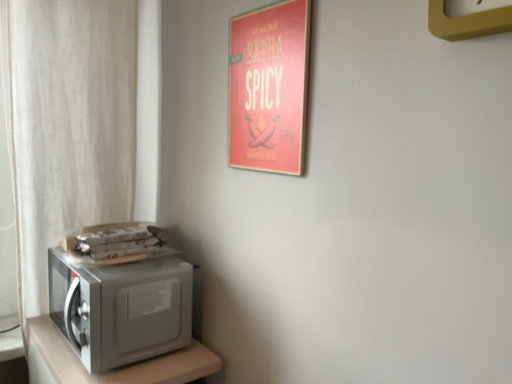
What do you see at coordinates (68, 124) in the screenshot? I see `white sheer curtain at left` at bounding box center [68, 124].

Locate an element on the screen. The image size is (512, 384). white sheer curtain at left is located at coordinates (68, 124).

Where is `satin silver microwave at lower left`? This screenshot has height=384, width=512. satin silver microwave at lower left is located at coordinates (122, 308).

Which of these two, satin silver microwave at left or yellow plastic clock at upper right, is thinner?

Thinner between the two is yellow plastic clock at upper right.

Is point (38, 319) less distant than point (475, 16)?

No, (38, 319) is behind (475, 16).

Is yellow plastic clock at upper right inside satin silver microwave at left?

Definitely not — yellow plastic clock at upper right is not inside satin silver microwave at left.

Does satin silver microwave at left lie in front of yellow plastic clock at upper right?

No, satin silver microwave at left is further to the viewer.

Relative to white sheer curtain at left, is satin silver microwave at left in front or behind?

Clearly, satin silver microwave at left is in front of white sheer curtain at left.

Can we say satin silver microwave at left lies outside white sheer curtain at left?

Absolutely, satin silver microwave at left is external to white sheer curtain at left.

Can you tell me how much satin silver microwave at left and white sheer curtain at left differ in facing direction?

There is a 90.3-degree angle between the facing directions of satin silver microwave at left and white sheer curtain at left.

Which object is positioned more to the right, satin silver microwave at left or white sheer curtain at left?

satin silver microwave at left.

Locate an element on the screen. clock above the white sheer curtain at left (from the image's perspective) is located at coordinates (467, 22).

From the image's perspective, is white sheer curtain at left positioned above or below yellow plastic clock at upper right?

From the image's perspective, white sheer curtain at left appears below yellow plastic clock at upper right.

Does point (30, 69) come farther from viewer compared to point (434, 25)?

Yes.

Would you say white sheer curtain at left is a long distance from yellow plastic clock at upper right?

white sheer curtain at left is positioned a significant distance from yellow plastic clock at upper right.

Between white sheer curtain at left and satin silver microwave at left, which one has smaller width?

With smaller width is white sheer curtain at left.

From the image's perspective, which one is positioned higher, white sheer curtain at left or satin silver microwave at left?

white sheer curtain at left.

Does white sheer curtain at left have a greater height compared to satin silver microwave at left?

Indeed, white sheer curtain at left has a greater height compared to satin silver microwave at left.

In the scene shown: Choose the correct answer: Is white sheer curtain at left inside satin silver microwave at left or outside it?

white sheer curtain at left cannot be found inside satin silver microwave at left.

In the image, there is a yellow plastic clock at upper right. Where is `home appliance below it (from the image's perspective)`? home appliance below it (from the image's perspective) is located at coordinates (122, 308).

From a real-world perspective, is satin silver microwave at lower left on top of yellow plastic clock at upper right?

No, from a real-world perspective, satin silver microwave at lower left is not above yellow plastic clock at upper right.

Is satin silver microwave at lower left at the right side of yellow plastic clock at upper right?

No.

Would you consider satin silver microwave at left to be distant from satin silver microwave at lower left?

Actually, satin silver microwave at left and satin silver microwave at lower left are a little close together.

Between satin silver microwave at left and satin silver microwave at lower left, which one appears on the right side from the viewer's perspective?

satin silver microwave at lower left is more to the right.

Is satin silver microwave at left positioned behind satin silver microwave at lower left?

No, satin silver microwave at left is closer to the viewer.

Looking at their sizes, would you say yellow plastic clock at upper right is wider or thinner than satin silver microwave at left?

yellow plastic clock at upper right is thinner than satin silver microwave at left.

Based on the photo, is yellow plastic clock at upper right next to satin silver microwave at left?

No, yellow plastic clock at upper right is not next to satin silver microwave at left.

Between yellow plastic clock at upper right and satin silver microwave at left, which one appears on the right side from the viewer's perspective?

From the viewer's perspective, yellow plastic clock at upper right appears more on the right side.

From a real-world perspective, is yellow plastic clock at upper right physically above satin silver microwave at left?

Yes, from a real-world perspective, yellow plastic clock at upper right is over satin silver microwave at left

Where is `clock above the satin silver microwave at left (from the image's perspective)`? clock above the satin silver microwave at left (from the image's perspective) is located at coordinates (467, 22).

Where is `furniture located in front of the white sheer curtain at left`? furniture located in front of the white sheer curtain at left is located at coordinates (111, 370).

From the image, which object appears to be nearer to satin silver microwave at left, white sheer curtain at left or yellow plastic clock at upper right?

white sheer curtain at left is positioned closer to the anchor satin silver microwave at left.

From the image, which object appears to be farther from satin silver microwave at lower left, satin silver microwave at left or white sheer curtain at left?

white sheer curtain at left lies further to satin silver microwave at lower left than the other object.

Based on their spatial positions, is satin silver microwave at lower left or satin silver microwave at left closer to white sheer curtain at left?

satin silver microwave at lower left.

When comparing their distances from satin silver microwave at lower left, does yellow plastic clock at upper right or satin silver microwave at left seem closer?

satin silver microwave at left is closer to satin silver microwave at lower left.

Considering their positions, is satin silver microwave at left positioned further to white sheer curtain at left than satin silver microwave at lower left?

→ Based on the image, satin silver microwave at left appears to be further to white sheer curtain at left.

Estimate the real-world distances between objects in this image. Which object is closer to white sheer curtain at left, satin silver microwave at left or yellow plastic clock at upper right?

satin silver microwave at left lies closer to white sheer curtain at left than the other object.

Estimate the real-world distances between objects in this image. Which object is further from white sheer curtain at left, yellow plastic clock at upper right or satin silver microwave at left?

yellow plastic clock at upper right.

From the picture: Estimate the real-world distances between objects in this image. Which object is closer to satin silver microwave at left, satin silver microwave at lower left or yellow plastic clock at upper right?

satin silver microwave at lower left.

Where is `home appliance between yellow plastic clock at upper right and satin silver microwave at left vertically`? This screenshot has width=512, height=384. home appliance between yellow plastic clock at upper right and satin silver microwave at left vertically is located at coordinates (122, 308).

You are a GUI agent. You are given a task and a screenshot of the screen. Output one action in this format:
    pyautogui.click(x=<x>, y=<y>)
    Task: Click on the home appliance located between white sheer curtain at left and yellow plastic clock at upper right in the left-right direction
    Image resolution: width=512 pixels, height=384 pixels.
    Given the screenshot: What is the action you would take?
    pyautogui.click(x=122, y=308)

Locate an element on the screen. The image size is (512, 384). home appliance between white sheer curtain at left and satin silver microwave at left vertically is located at coordinates (122, 308).

Locate an element on the screen. This screenshot has width=512, height=384. furniture situated between white sheer curtain at left and yellow plastic clock at upper right from left to right is located at coordinates (111, 370).